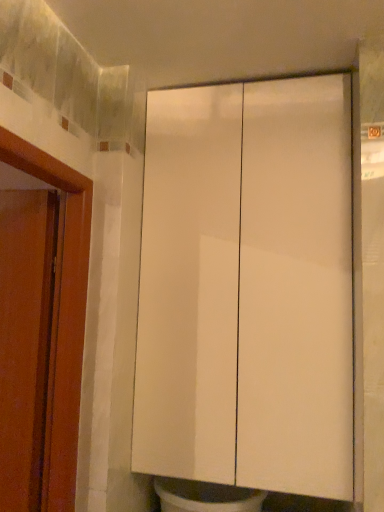
The image size is (384, 512). What do you see at coordinates (25, 340) in the screenshot? I see `matte wood door at left` at bounding box center [25, 340].

Image resolution: width=384 pixels, height=512 pixels. What are the coordinates of `matte wood door at left` in the screenshot? It's located at (25, 340).

In order to face white glossy cabinet at center, should I rotate leftwards or rightwards?

To face it directly, rotate right by 7.172 degrees.

Find the location of a particular element. white glossy cabinet at center is located at coordinates (x=247, y=287).

What do you see at coordinates (247, 287) in the screenshot? This screenshot has width=384, height=512. I see `white glossy cabinet at center` at bounding box center [247, 287].

Locate an element on the screen. The width and height of the screenshot is (384, 512). matte wood door at left is located at coordinates (25, 340).

Which is more to the left, white glossy cabinet at center or matte wood door at left?

matte wood door at left is more to the left.

Relative to matte wood door at left, is white glossy cabinet at center in front or behind?

In the image, white glossy cabinet at center appears behind matte wood door at left.

Does point (268, 409) lie in front of point (44, 288)?

No, it is behind (44, 288).

From the image's perspective, is white glossy cabinet at center positioned above or below matte wood door at left?

white glossy cabinet at center is situated higher than matte wood door at left in the image.

From a real-world perspective, between white glossy cabinet at center and matte wood door at left, who is vertically lower?

matte wood door at left.

Which object is thinner, white glossy cabinet at center or matte wood door at left?

matte wood door at left.

Between white glossy cabinet at center and matte wood door at left, which one has more height?

white glossy cabinet at center.

Does white glossy cabinet at center have a larger size compared to matte wood door at left?

Indeed, white glossy cabinet at center has a larger size compared to matte wood door at left.

Would you say white glossy cabinet at center is outside matte wood door at left?

white glossy cabinet at center lies outside matte wood door at left's area.

Does white glossy cabinet at center touch matte wood door at left?

No, white glossy cabinet at center is not next to matte wood door at left.

Is white glossy cabinet at center turned away from matte wood door at left?

That's not correct — white glossy cabinet at center is not looking away from matte wood door at left.

Locate an element on the screen. door on the left side of white glossy cabinet at center is located at coordinates (25, 340).

Considering the relative positions of matte wood door at left and white glossy cabinet at center in the image provided, is matte wood door at left to the right of white glossy cabinet at center from the viewer's perspective?

In fact, matte wood door at left is to the left of white glossy cabinet at center.

Relative to white glossy cabinet at center, is matte wood door at left in front or behind?

Clearly, matte wood door at left is in front of white glossy cabinet at center.

Is point (3, 373) positioned after point (170, 234)?

That is False.

From the image's perspective, is matte wood door at left positioned above or below white glossy cabinet at center?

Clearly, from the image's perspective, matte wood door at left is below white glossy cabinet at center.

From a real-world perspective, who is located higher, matte wood door at left or white glossy cabinet at center?

In real-world perspective, white glossy cabinet at center is above.

Considering the sizes of objects matte wood door at left and white glossy cabinet at center in the image provided, who is thinner, matte wood door at left or white glossy cabinet at center?

matte wood door at left is thinner.

Considering the relative sizes of matte wood door at left and white glossy cabinet at center in the image provided, is matte wood door at left shorter than white glossy cabinet at center?

Correct, matte wood door at left is not as tall as white glossy cabinet at center.

Is matte wood door at left bigger than white glossy cabinet at center?

No.

From the picture: Would you say matte wood door at left is outside white glossy cabinet at center?

Indeed, matte wood door at left is completely outside white glossy cabinet at center.

Does matte wood door at left touch white glossy cabinet at center?

No, matte wood door at left is not next to white glossy cabinet at center.

Is matte wood door at left facing towards white glossy cabinet at center?

No, matte wood door at left is not turned towards white glossy cabinet at center.

What's the angular difference between matte wood door at left and white glossy cabinet at center's facing directions?

There is a 4.04-degree angle between the facing directions of matte wood door at left and white glossy cabinet at center.

Looking at this image, measure the distance from matte wood door at left to white glossy cabinet at center.

matte wood door at left is 22.54 inches away from white glossy cabinet at center.

The image size is (384, 512). I want to click on cabinetry on the right of matte wood door at left, so click(247, 287).

This screenshot has width=384, height=512. Identify the location of door below the white glossy cabinet at center (from a real-world perspective). (25, 340).

Identify the location of cabinetry to the right of matte wood door at left. Image resolution: width=384 pixels, height=512 pixels. (247, 287).